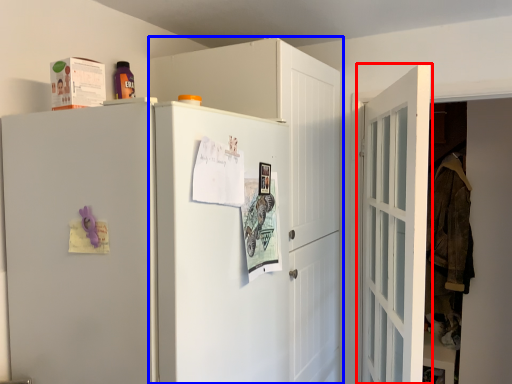
Question: Among these objects, which one is nearest to the camera, door (highlighted by a red box) or cabinetry (highlighted by a blue box)?

Choices:
 (A) door
 (B) cabinetry

Answer: (A)